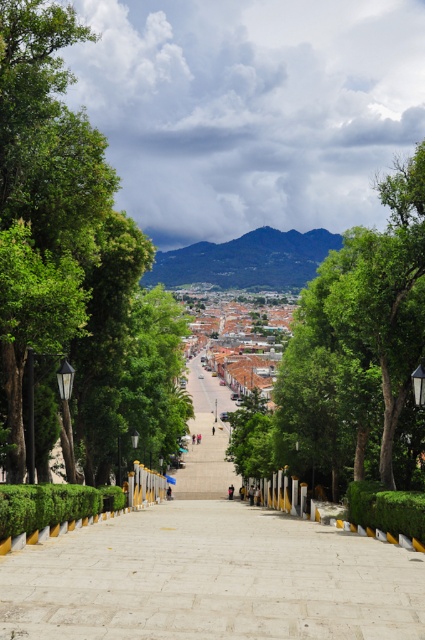
You are standing at the bottom of the staircase looking up. There is a point marked at coordinates [354,346]. Which object in the scene does this point correspond to?

The point at coordinates [354,346] corresponds to the green leafy tree at upper center.